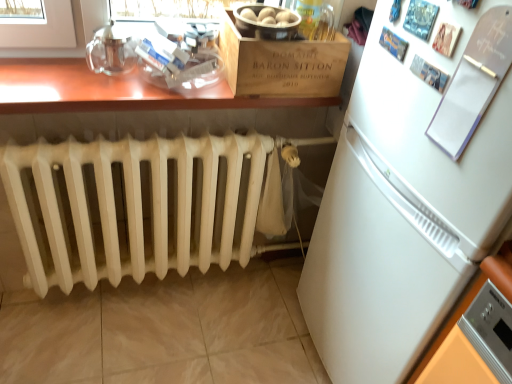
What is the approximate height of wooden table at upper center?

wooden table at upper center is 1.54 inches tall.

What do you see at coordinates (112, 91) in the screenshot? I see `wooden table at upper center` at bounding box center [112, 91].

Measure the distance between white paperboard at upper right and camera.

A distance of 27.77 inches exists between white paperboard at upper right and camera.

Find the location of `wooden table at upper center`. wooden table at upper center is located at coordinates (112, 91).

Which of these two, wooden table at upper center or white matte refrigerator at right, is wider?

white matte refrigerator at right is wider.

Does wooden table at upper center appear on the right side of white matte refrigerator at right?

Incorrect, wooden table at upper center is not on the right side of white matte refrigerator at right.

Is wooden table at upper center positioned beyond the bounds of white matte refrigerator at right?

Yes, wooden table at upper center is outside of white matte refrigerator at right.

From the image's perspective, relative to white matte refrigerator at right, is wooden table at upper center above or below?

Clearly, from the image's perspective, wooden table at upper center is above white matte refrigerator at right.

Is white matte refrigerator at right oriented away from white painted radiator at lower left?

That's not correct — white matte refrigerator at right is not looking away from white painted radiator at lower left.

Locate an element on the screen. This screenshot has width=512, height=384. radiator below the white matte refrigerator at right (from a real-world perspective) is located at coordinates (140, 206).

Is white matte refrigerator at right positioned beyond the bounds of white painted radiator at lower left?

Absolutely, white matte refrigerator at right is external to white painted radiator at lower left.

Would you consider white matte refrigerator at right to be distant from white painted radiator at lower left?

No, white matte refrigerator at right is in close proximity to white painted radiator at lower left.

Where is `bulletin board that appears above the white painted radiator at lower left (from the image's perspective)`? bulletin board that appears above the white painted radiator at lower left (from the image's perspective) is located at coordinates (474, 82).

Is white paperboard at upper right at the back of white painted radiator at lower left?

white painted radiator at lower left is not turned away from white paperboard at upper right.

Which of these two, white painted radiator at lower left or white paperboard at upper right, stands taller?

With more height is white painted radiator at lower left.

Between white painted radiator at lower left and white paperboard at upper right, which one has smaller width?

Thinner between the two is white paperboard at upper right.

Between wooden table at upper center and white painted radiator at lower left, which one appears on the right side from the viewer's perspective?

From the viewer's perspective, wooden table at upper center appears more on the right side.

Is wooden table at upper center positioned with its back to white painted radiator at lower left?

No.

Considering the relative sizes of wooden table at upper center and white painted radiator at lower left in the image provided, is wooden table at upper center taller than white painted radiator at lower left?

Incorrect, the height of wooden table at upper center is not larger of that of white painted radiator at lower left.

Locate an element on the screen. This screenshot has width=512, height=384. table above the white painted radiator at lower left (from a real-world perspective) is located at coordinates click(112, 91).

From a real-world perspective, who is located higher, white painted radiator at lower left or white matte refrigerator at right?

From a 3D spatial view, white matte refrigerator at right is above.

Considering the positions of objects white painted radiator at lower left and white matte refrigerator at right in the image provided, who is more to the right, white painted radiator at lower left or white matte refrigerator at right?

white matte refrigerator at right is more to the right.

Is point (52, 253) in front of point (472, 222)?

No, (52, 253) is further to viewer.

Is there a large distance between white painted radiator at lower left and white matte refrigerator at right?

No, there isn't a large distance between white painted radiator at lower left and white matte refrigerator at right.

Considering the sizes of objects white matte refrigerator at right and wooden table at upper center in the image provided, who is thinner, white matte refrigerator at right or wooden table at upper center?

Thinner between the two is wooden table at upper center.

Does white matte refrigerator at right lie in front of wooden table at upper center?

Yes.

Is white matte refrigerator at right situated inside wooden table at upper center or outside?

white matte refrigerator at right cannot be found inside wooden table at upper center.

Which is in front, white paperboard at upper right or wooden table at upper center?

white paperboard at upper right.

Does white paperboard at upper right have a greater width compared to wooden table at upper center?

Incorrect, the width of white paperboard at upper right does not surpass that of wooden table at upper center.

Could you tell me if white paperboard at upper right is turned towards wooden table at upper center?

No, white paperboard at upper right is not aimed at wooden table at upper center.

In the image, there is a wooden table at upper center. Identify the location of refrigerator below it (from the image's perspective). The width and height of the screenshot is (512, 384). [x=402, y=207].

What are the coordinates of `refrigerator above the white painted radiator at lower left (from the image's perspective)` in the screenshot? It's located at (402, 207).

When comparing their distances from white painted radiator at lower left, does white paperboard at upper right or white matte refrigerator at right seem further?

The object further to white painted radiator at lower left is white paperboard at upper right.

From the image, which object appears to be nearer to wooden table at upper center, wooden crate at upper center or white paperboard at upper right?

The object closer to wooden table at upper center is wooden crate at upper center.

Estimate the real-world distances between objects in this image. Which object is further from wooden crate at upper center, white matte refrigerator at right or white painted radiator at lower left?

white painted radiator at lower left.

Consider the image. Which object lies nearer to the anchor point wooden table at upper center, white paperboard at upper right or white matte refrigerator at right?

white matte refrigerator at right lies closer to wooden table at upper center than the other object.

When comparing their distances from wooden crate at upper center, does wooden table at upper center or white paperboard at upper right seem further?

white paperboard at upper right is positioned further to the anchor wooden crate at upper center.

When comparing their distances from white paperboard at upper right, does wooden crate at upper center or wooden table at upper center seem closer?

wooden crate at upper center is positioned closer to the anchor white paperboard at upper right.

From the picture: Considering their positions, is white matte refrigerator at right positioned further to white painted radiator at lower left than wooden table at upper center?

white matte refrigerator at right lies further to white painted radiator at lower left than the other object.

When comparing their distances from white painted radiator at lower left, does white paperboard at upper right or wooden crate at upper center seem closer?

The object closer to white painted radiator at lower left is wooden crate at upper center.

In order to click on cardboard box between wooden table at upper center and white paperboard at upper right from left to right in this screenshot , I will do `click(281, 63)`.

Where is `table situated between white painted radiator at lower left and white paperboard at upper right from left to right`? The height and width of the screenshot is (384, 512). table situated between white painted radiator at lower left and white paperboard at upper right from left to right is located at coordinates (112, 91).

At what (x,y) coordinates should I click in order to perform the action: click on bulletin board between white matte refrigerator at right and wooden crate at upper center in the front-back direction. Please return your answer as a coordinate pair (x, y). Looking at the image, I should click on (474, 82).

Locate an element on the screen. The width and height of the screenshot is (512, 384). cardboard box situated between white painted radiator at lower left and white matte refrigerator at right from left to right is located at coordinates (281, 63).